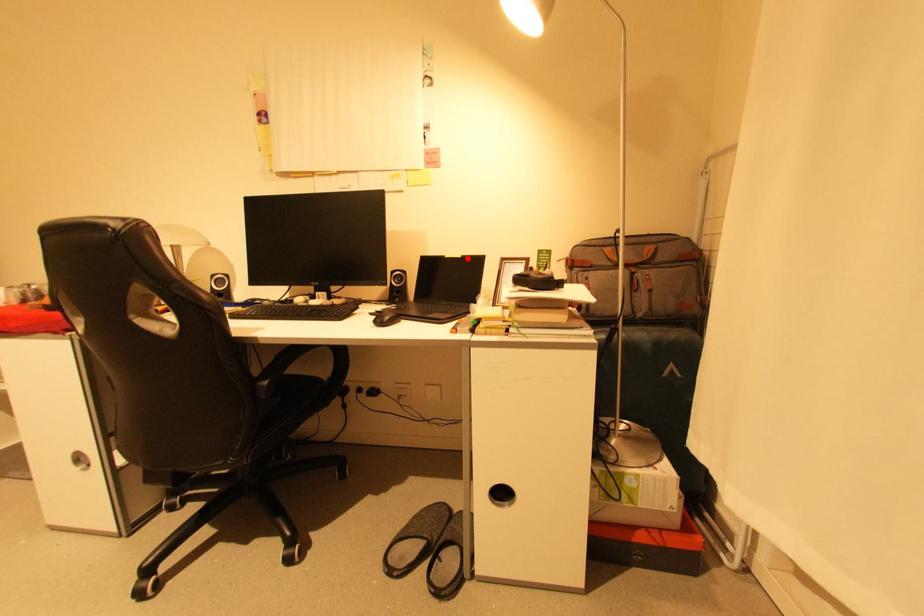
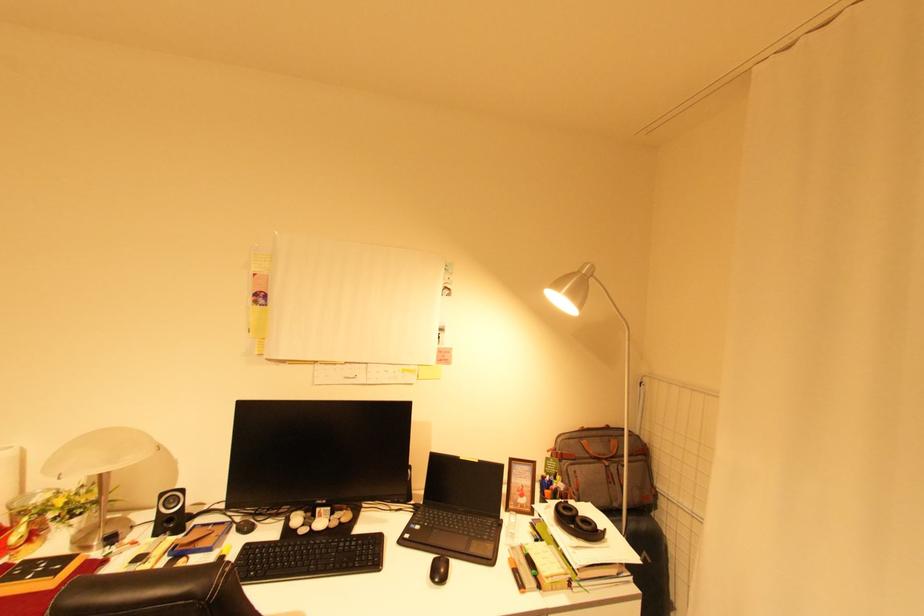
In the second image, find the point that corresponds to the highlighted location in the first image.

(484, 462)